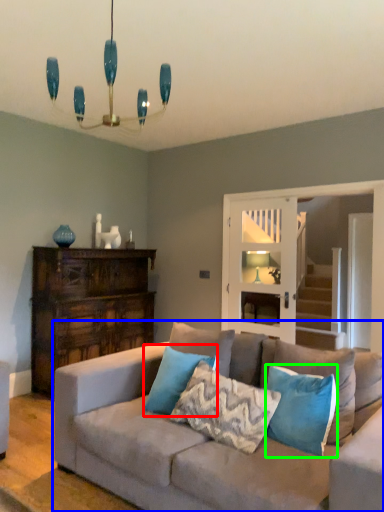
Question: Which object is the farthest from pillow (highlighted by a red box)? Choose among these: studio couch (highlighted by a blue box) or pillow (highlighted by a green box).

Choices:
 (A) studio couch
 (B) pillow

Answer: (B)